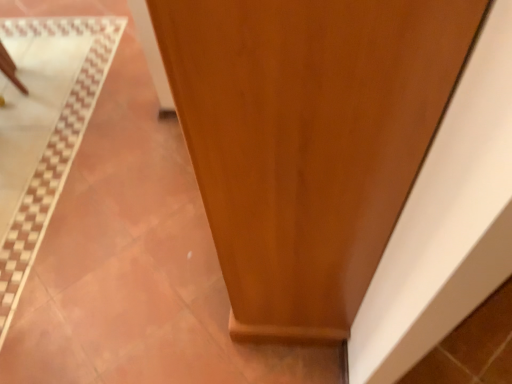
This screenshot has height=384, width=512. What do you see at coordinates (308, 140) in the screenshot?
I see `wooden pillar at center` at bounding box center [308, 140].

Measure the distance between point (223, 134) and camera.

The distance of point (223, 134) from camera is 21.38 inches.

Locate an element on the screen. The width and height of the screenshot is (512, 384). wooden pillar at center is located at coordinates (308, 140).

Where is `wooden pillar at center`? The height and width of the screenshot is (384, 512). wooden pillar at center is located at coordinates (308, 140).